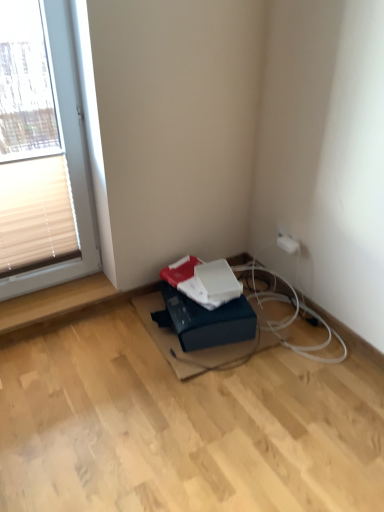
The width and height of the screenshot is (384, 512). Identify the location of free space above blue cardboard box at lower center (from a real-world perspective). (198, 300).